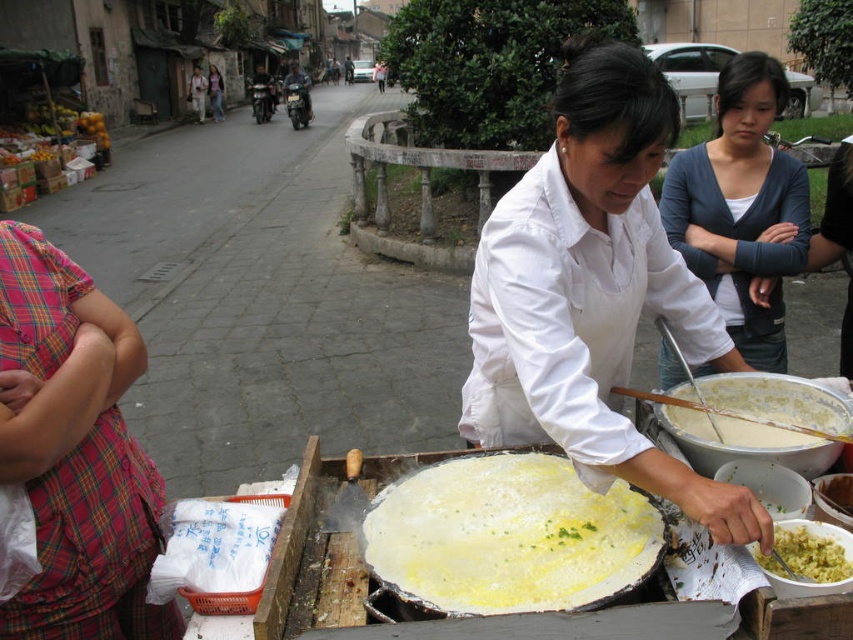
Question: Which of the following is the farthest from the observer?

Choices:
 (A) yellow/flaky pancake at center
 (B) matte white shirt at center

Answer: (B)

Question: Is white creamy batter at lower right positioned in front of yellow crumbly rice at lower right?

Choices:
 (A) yes
 (B) no

Answer: (B)

Question: Can you confirm if dark gray sweater at center is positioned below yellow crumbly rice at lower right?

Choices:
 (A) no
 (B) yes

Answer: (A)

Question: Is plaid fabric shirt at left thinner than yellow crumbly rice at lower right?

Choices:
 (A) no
 (B) yes

Answer: (A)

Question: Which of the following is the farthest from the observer?

Choices:
 (A) (782, 524)
 (B) (720, 234)

Answer: (B)

Question: Based on their relative distances, which object is nearer to the yellow crumbly rice at lower right?

Choices:
 (A) dark gray sweater at center
 (B) plaid fabric shirt at left

Answer: (A)